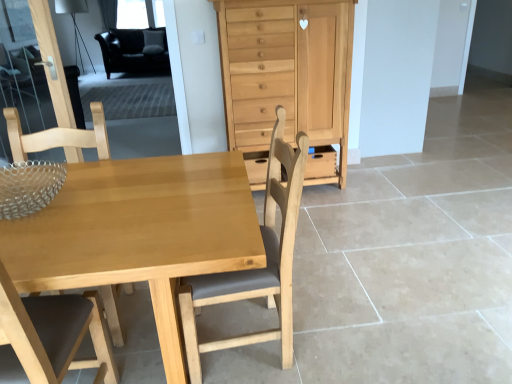
Question: Considering the relative sizes of matte wood drawer at center and light wood table at center in the image provided, is matte wood drawer at center shorter than light wood table at center?

Choices:
 (A) yes
 (B) no

Answer: (A)

Question: From the image's perspective, would you say matte wood drawer at center is positioned over light wood table at center?

Choices:
 (A) yes
 (B) no

Answer: (A)

Question: Can you confirm if matte wood drawer at center is taller than light wood table at center?

Choices:
 (A) yes
 (B) no

Answer: (B)

Question: From a real-world perspective, is matte wood drawer at center over light wood table at center?

Choices:
 (A) yes
 (B) no

Answer: (B)

Question: Is the depth of matte wood drawer at center less than that of light wood table at center?

Choices:
 (A) no
 (B) yes

Answer: (A)

Question: Are matte wood drawer at center and light wood table at center far apart?

Choices:
 (A) yes
 (B) no

Answer: (A)

Question: Does light brown wood chair at center, the 2th chair from the left, have a greater height compared to light brown wood chair at left, the 2th chair when ordered from right to left?

Choices:
 (A) no
 (B) yes

Answer: (A)

Question: From a real-world perspective, is light brown wood chair at center, the 2th chair from the left, physically below light brown wood chair at left, the 2th chair when ordered from right to left?

Choices:
 (A) no
 (B) yes

Answer: (B)

Question: Does light brown wood chair at center, the 2th chair from the left, contain light brown wood chair at left, the first chair from the left?

Choices:
 (A) no
 (B) yes

Answer: (A)

Question: From a real-world perspective, is light brown wood chair at center, which ranks as the first chair in right-to-left order, over light brown wood chair at left, the first chair from the left?

Choices:
 (A) yes
 (B) no

Answer: (B)

Question: Is the position of light brown wood chair at center, which ranks as the first chair in right-to-left order, more distant than that of light brown wood chair at left, the 2th chair when ordered from right to left?

Choices:
 (A) no
 (B) yes

Answer: (A)

Question: Can you confirm if light brown wood chair at center, which ranks as the first chair in right-to-left order, is positioned to the left of light brown wood chair at left, the 2th chair when ordered from right to left?

Choices:
 (A) no
 (B) yes

Answer: (A)

Question: Is light brown wood chair at center, the 2th chair from the left, positioned with its back to light wood table at center?

Choices:
 (A) no
 (B) yes

Answer: (B)